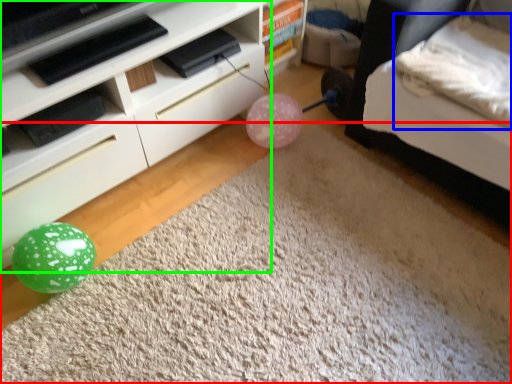
Question: Estimate the real-world distances between objects in this image. Which object is closer to plain (highlighted by a red box), pillow (highlighted by a blue box) or furniture (highlighted by a green box)?

Choices:
 (A) pillow
 (B) furniture

Answer: (B)